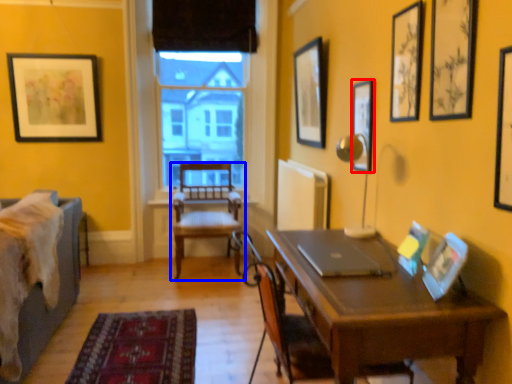
Question: Which object is closer to the camera taking this photo, picture frame (highlighted by a red box) or chair (highlighted by a blue box)?

Choices:
 (A) picture frame
 (B) chair

Answer: (A)